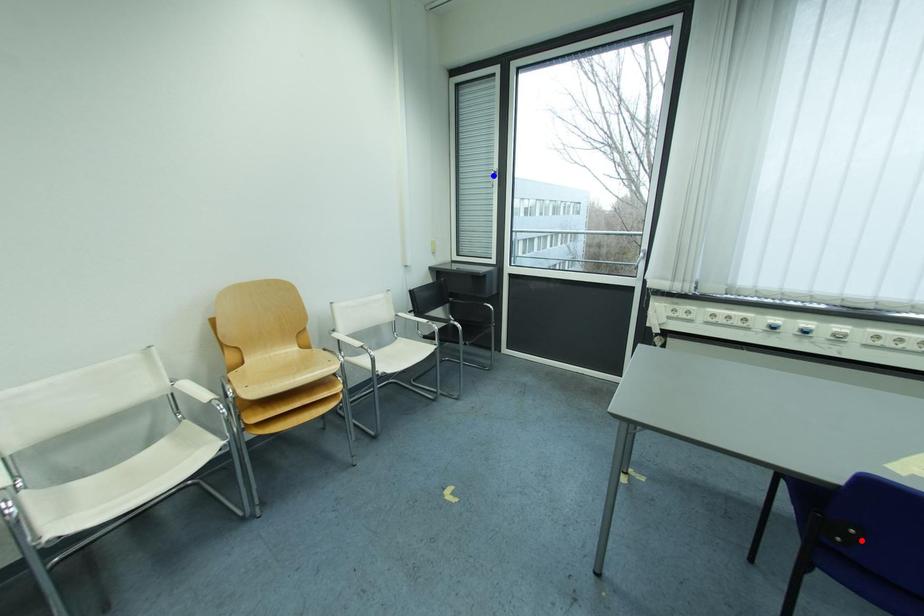
Question: Which of the two points in the image is closer to the camera?

Choices:
 (A) Blue point is closer.
 (B) Red point is closer.

Answer: (B)